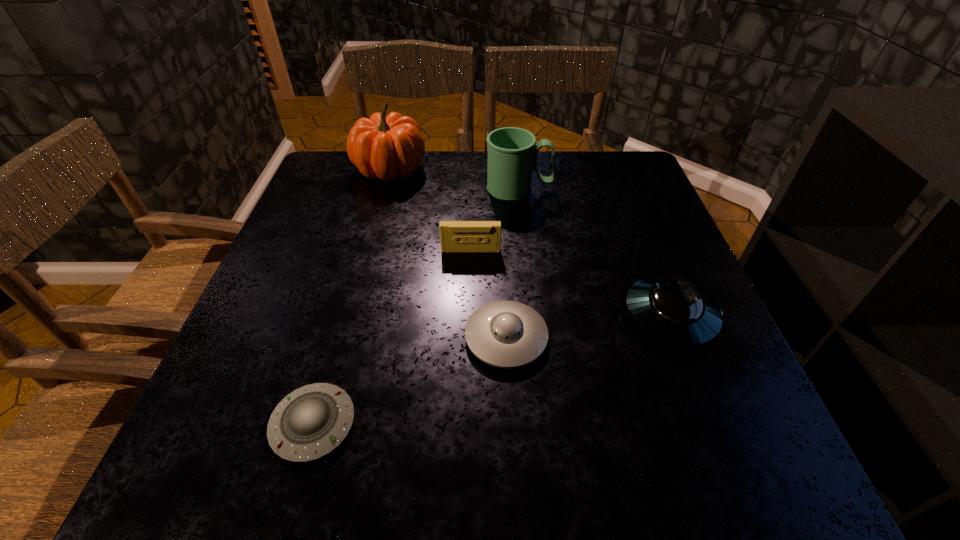
Locate an element on the screen. The image size is (960, 540). the fourth closest object relative to the third farthest object is located at coordinates (673, 309).

In order to click on object identified as the third closest to the videotape in this screenshot , I will do `click(382, 147)`.

Identify which saucer is located as the second nearest to the leftmost saucer. Please provide its 2D coordinates. Your answer should be formatted as a tuple, i.e. [(x, y)], where the tuple contains the x and y coordinates of a point satisfying the conditions above.

[(673, 309)]

Find the location of a particular element. saucer identified as the closest to the tallest object is located at coordinates (506, 334).

Where is `vacant area that satisfies the following two spatial constraints: 1. on the side of the second tallest object with the handle; 2. on the left side of the rightmost saucer`? vacant area that satisfies the following two spatial constraints: 1. on the side of the second tallest object with the handle; 2. on the left side of the rightmost saucer is located at coordinates (534, 316).

This screenshot has width=960, height=540. In order to click on vacant space that satisfies the following two spatial constraints: 1. at the front of the second shortest saucer with spools; 2. on the left side of the fourth shortest object in this screenshot , I will do `click(468, 338)`.

Find the location of a particular element. The height and width of the screenshot is (540, 960). free space that satisfies the following two spatial constraints: 1. on the back side of the rightmost object; 2. on the side of the fifth shortest object with the handle is located at coordinates (620, 190).

You are a GUI agent. You are given a task and a screenshot of the screen. Output one action in this format:
    pyautogui.click(x=<x>, y=<y>)
    Task: Click on the vacant space that satisfies the following two spatial constraints: 1. at the front of the rightmost object with spools; 2. on the right side of the videotape
    This screenshot has height=540, width=960.
    Given the screenshot: What is the action you would take?
    pyautogui.click(x=469, y=316)

What are the coordinates of `free space in the image that satisfies the following two spatial constraints: 1. on the side of the third shortest object with the handle; 2. on the left side of the mug` in the screenshot? It's located at (534, 316).